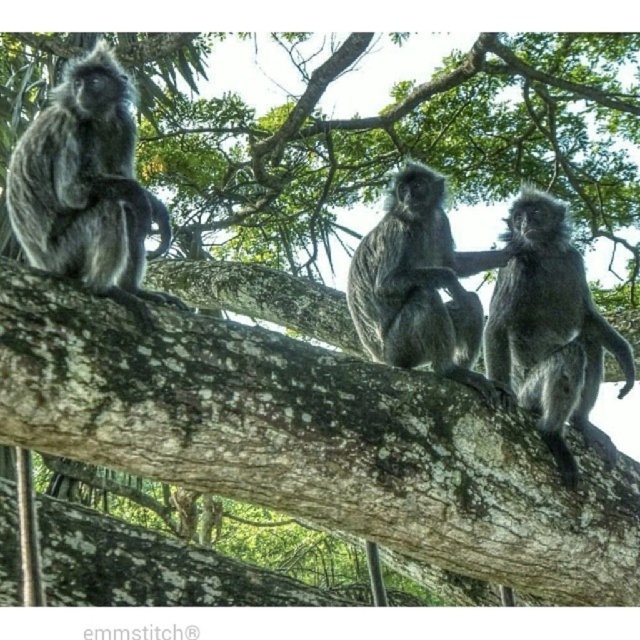
You are a wildlife photographer aiming to capture a closeup of the monkeys. Your camera has a zoom lens that can focus on subjects within a 1.5 meter range. If you are positioned to focus on the silvery fur monkey at left, will the silvery fur monkey at center also be in focus?

The silvery fur monkey at left and silvery fur monkey at center are 1.37 meters apart. Since the distance between them is within the 1.5 meter range of your camera lens, both monkeys would be in focus when focusing on the silvery fur monkey at left.

You are a wildlife photographer trying to capture a group of monkeys on a tree branch. You notice two monkeys, the silvery fur monkey at left and the silvery fur monkey at center. Which monkey would appear closer to the camera if they are both facing forward?

The silvery fur monkey at left is smaller than the silvery fur monkey at center. Since the left monkey is smaller, it might be farther away from the camera, making the center monkey appear closer.